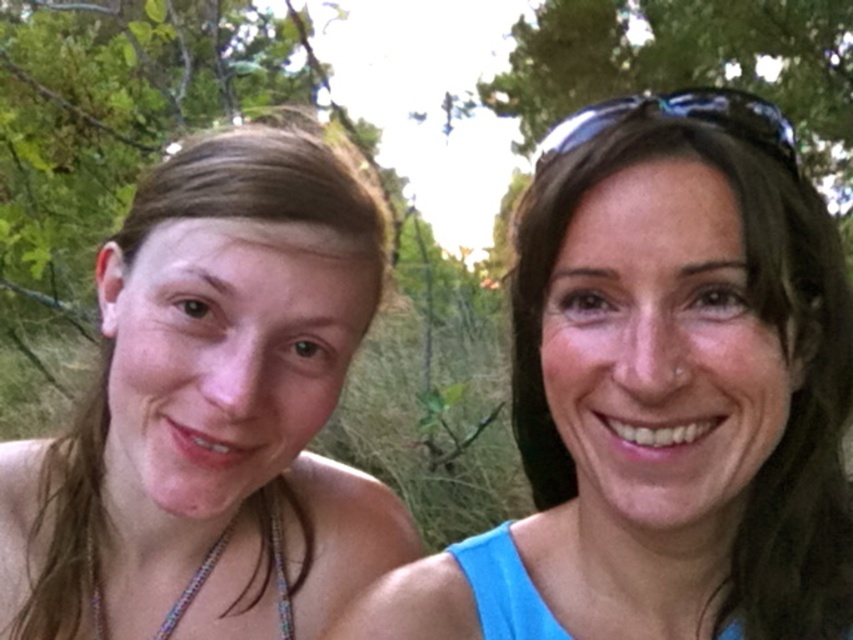
Consider the image. Which is above, matte skin girl at left or multicolored beaded necklace at lower left?

matte skin girl at left is above.

Is matte skin girl at left taller than multicolored beaded necklace at lower left?

Yes, matte skin girl at left is taller than multicolored beaded necklace at lower left.

The width and height of the screenshot is (853, 640). Describe the element at coordinates (210, 408) in the screenshot. I see `matte skin girl at left` at that location.

The height and width of the screenshot is (640, 853). What are the coordinates of `matte skin girl at left` in the screenshot? It's located at (210, 408).

Is point (712, 216) behind point (303, 186)?

No, (712, 216) is closer to viewer.

Between blue fabric top at right and matte skin girl at left, which one appears on the left side from the viewer's perspective?

Positioned to the left is matte skin girl at left.

Measure the distance between point [602,531] and camera.

A distance of 25.09 inches exists between point [602,531] and camera.

At what (x,y) coordinates should I click in order to perform the action: click on blue fabric top at right. Please return your answer as a coordinate pair (x, y). The image size is (853, 640). Looking at the image, I should click on (662, 396).

Does point (728, 172) lie in front of point (170, 614)?

Yes, point (728, 172) is closer to viewer.

Between point (672, 560) and point (187, 605), which one is positioned behind?

The point (187, 605) is more distant.

In order to click on blue fabric top at right in this screenshot , I will do `click(662, 396)`.